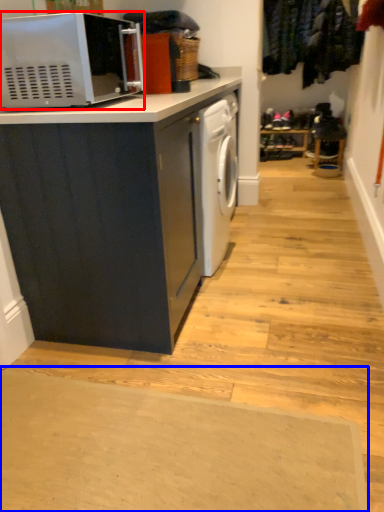
Question: Which object is further to the camera taking this photo, microwave oven (highlighted by a red box) or doormat (highlighted by a blue box)?

Choices:
 (A) microwave oven
 (B) doormat

Answer: (A)